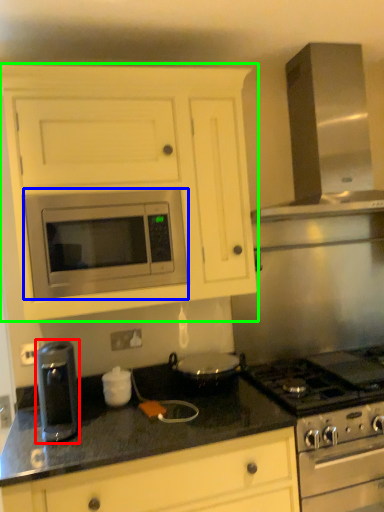
Question: Which object is positioned farthest from kitchen appliance (highlighted by a red box)? Select from microwave oven (highlighted by a blue box) and cabinetry (highlighted by a green box).

Choices:
 (A) microwave oven
 (B) cabinetry

Answer: (B)